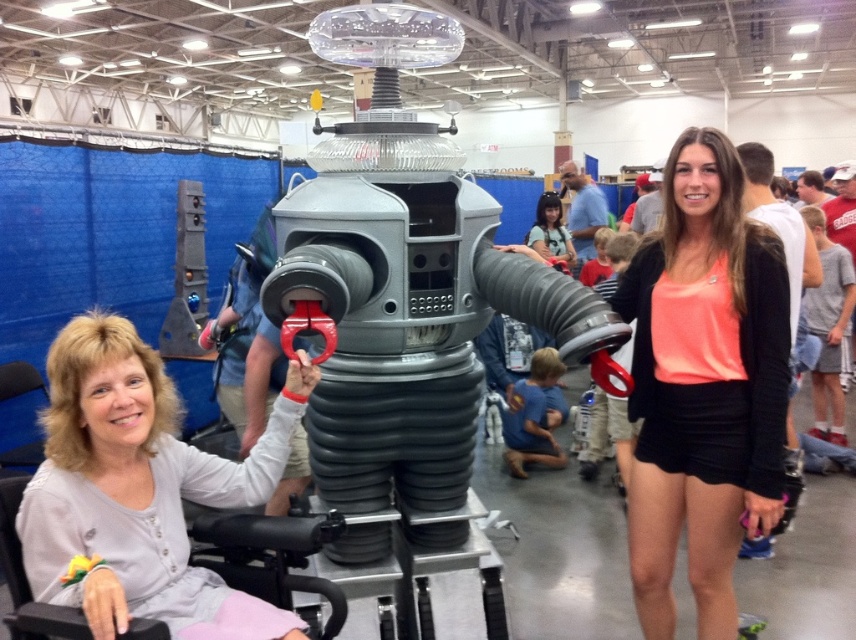
Question: Is neon orange fabric at center bigger than light gray fabric at left?

Choices:
 (A) yes
 (B) no

Answer: (A)

Question: Can you confirm if neon orange fabric at center is bigger than matte black hair at center?

Choices:
 (A) no
 (B) yes

Answer: (A)

Question: From the image, what is the correct spatial relationship of neon orange fabric at center in relation to light gray fabric at left?

Choices:
 (A) left
 (B) right

Answer: (B)

Question: Based on their relative distances, which object is nearer to the neon orange fabric at center?

Choices:
 (A) light gray fabric at left
 (B) matte black hair at center

Answer: (A)

Question: Which of the following is the farthest from the observer?

Choices:
 (A) (527, 236)
 (B) (702, 481)

Answer: (A)

Question: Which object is the closest to the light gray fabric at left?

Choices:
 (A) matte black hair at center
 (B) neon orange fabric at center

Answer: (B)